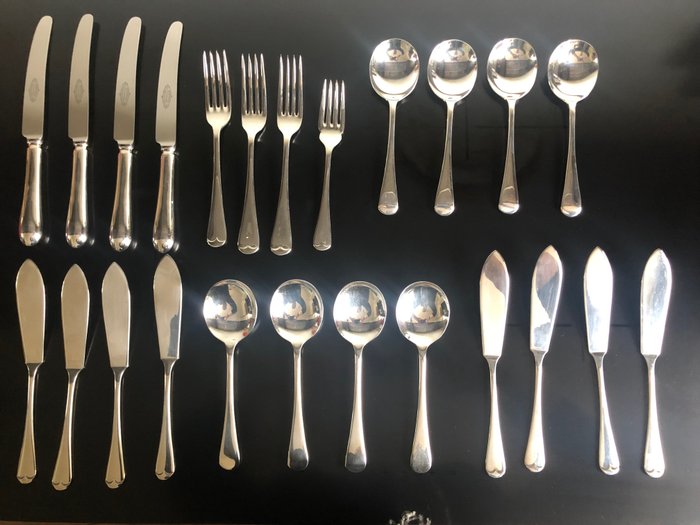
Identify the location of spoons. The width and height of the screenshot is (700, 525). coord(238,301), coord(302,309), coord(386,307), coord(421,306), coord(404,71), coord(462,60), coord(517,57), coord(589,56).